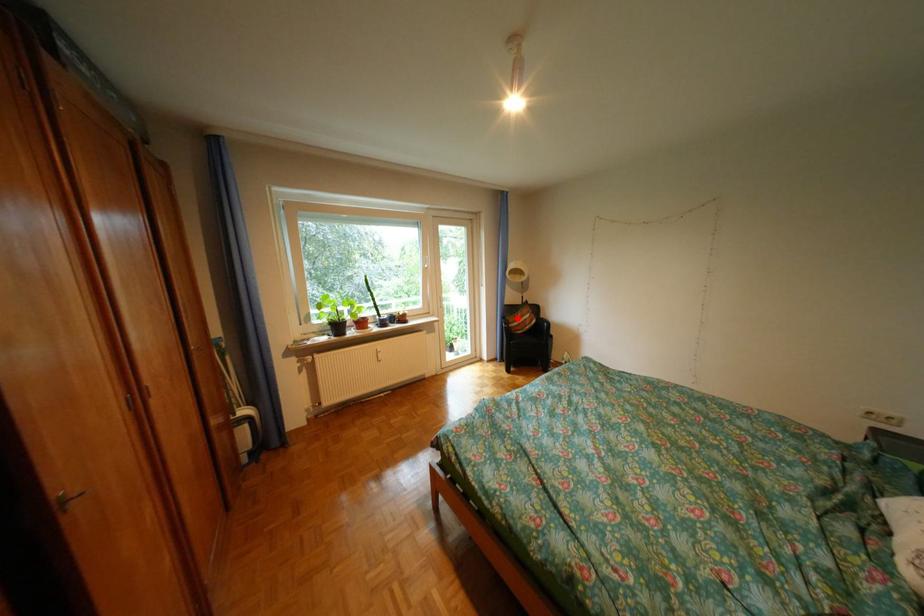
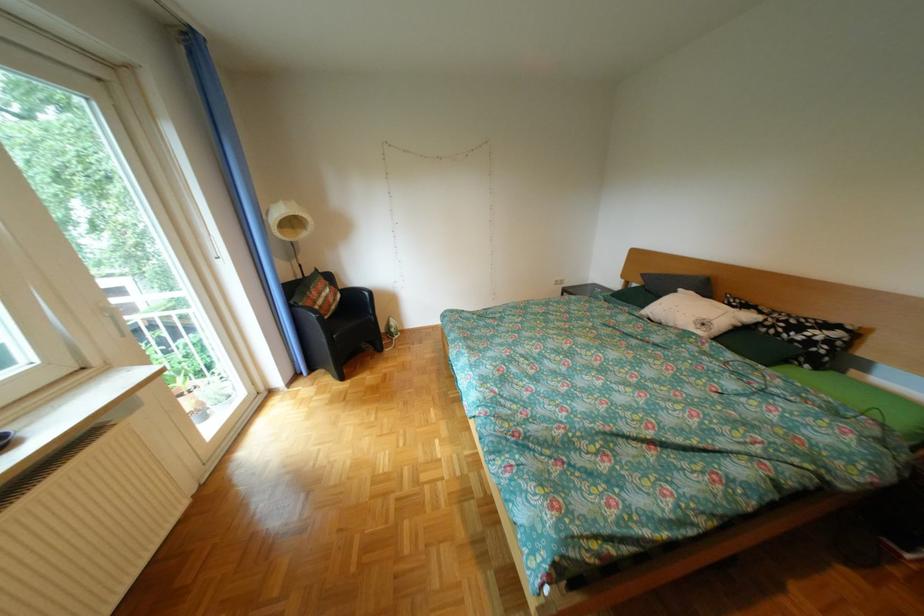
Question: I am providing you with two images of the same scene from different viewpoints. In image1, a red point is highlighted. Considering the same 3D point in image2, which of the following is correct?

Choices:
 (A) It is closer
 (B) It is farther

Answer: (A)